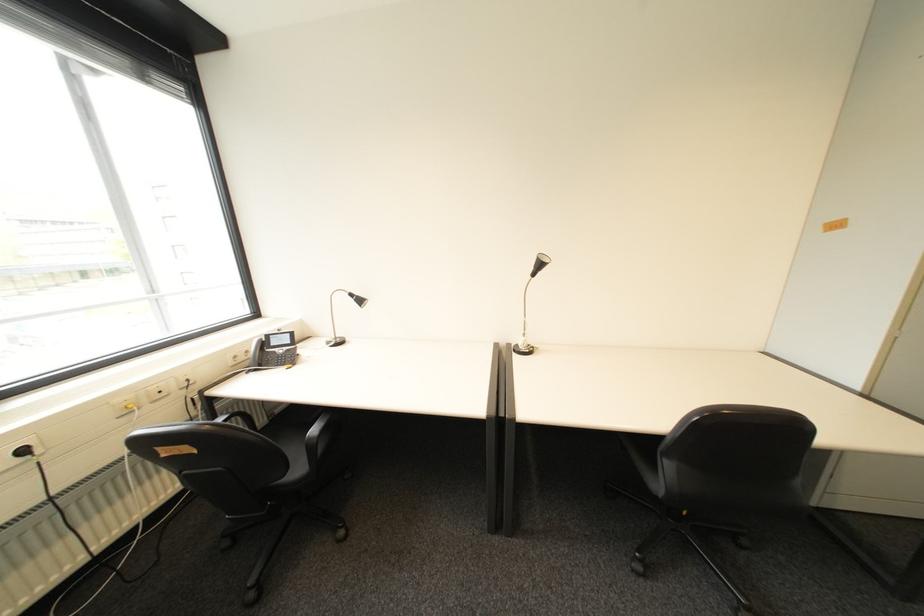
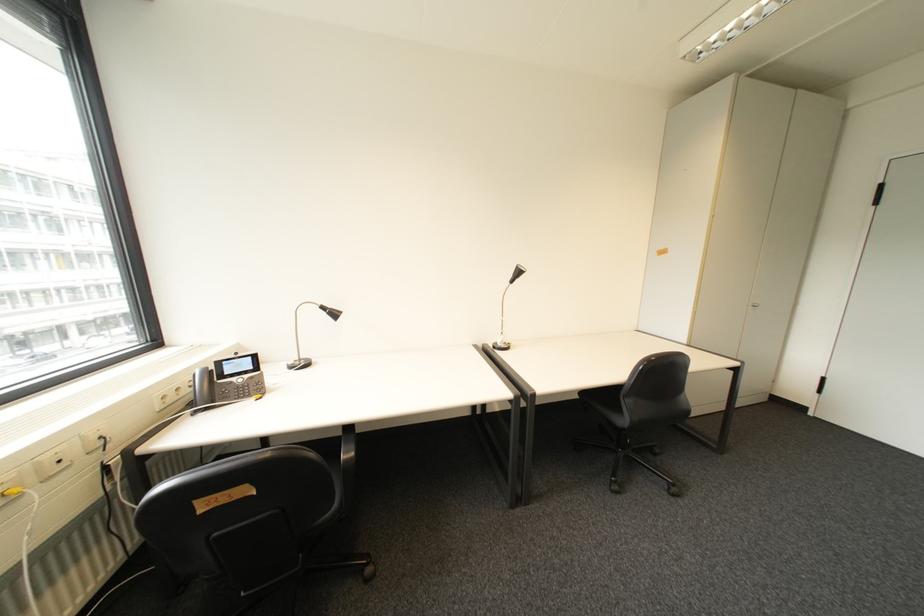
Question: The first image is from the beginning of the video and the second image is from the end. How did the camera likely rotate when shooting the video?

Choices:
 (A) Left
 (B) Right
 (C) Up
 (D) Down

Answer: (B)